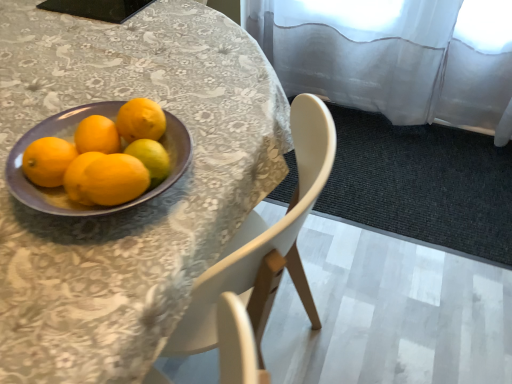
Question: Does purple plate at upper left have a larger size compared to purple glossy bowl at left?

Choices:
 (A) no
 (B) yes

Answer: (B)

Question: Is there a large distance between purple plate at upper left and purple glossy bowl at left?

Choices:
 (A) yes
 (B) no

Answer: (B)

Question: From the image's perspective, is purple plate at upper left above purple glossy bowl at left?

Choices:
 (A) yes
 (B) no

Answer: (B)

Question: Can you confirm if purple plate at upper left is smaller than purple glossy bowl at left?

Choices:
 (A) no
 (B) yes

Answer: (A)

Question: From a real-world perspective, is purple plate at upper left physically above purple glossy bowl at left?

Choices:
 (A) yes
 (B) no

Answer: (B)

Question: Is purple plate at upper left turned away from purple glossy bowl at left?

Choices:
 (A) no
 (B) yes

Answer: (A)

Question: From the image's perspective, does matte yellow orange at left appear lower than yellow matte lemon at center?

Choices:
 (A) no
 (B) yes

Answer: (B)

Question: From a real-world perspective, is matte yellow orange at left physically below yellow matte lemon at center?

Choices:
 (A) yes
 (B) no

Answer: (B)

Question: Is yellow matte lemon at center located within matte yellow orange at left?

Choices:
 (A) yes
 (B) no

Answer: (B)

Question: Is matte yellow orange at left looking in the opposite direction of yellow matte lemon at center?

Choices:
 (A) no
 (B) yes

Answer: (A)

Question: Is matte yellow orange at left outside of yellow matte lemon at center?

Choices:
 (A) yes
 (B) no

Answer: (A)

Question: Considering the relative sizes of matte yellow orange at left and yellow matte lemon at center in the image provided, is matte yellow orange at left thinner than yellow matte lemon at center?

Choices:
 (A) no
 (B) yes

Answer: (B)

Question: From a real-world perspective, is yellow matte lemon at center on purple glossy bowl at left?

Choices:
 (A) yes
 (B) no

Answer: (A)